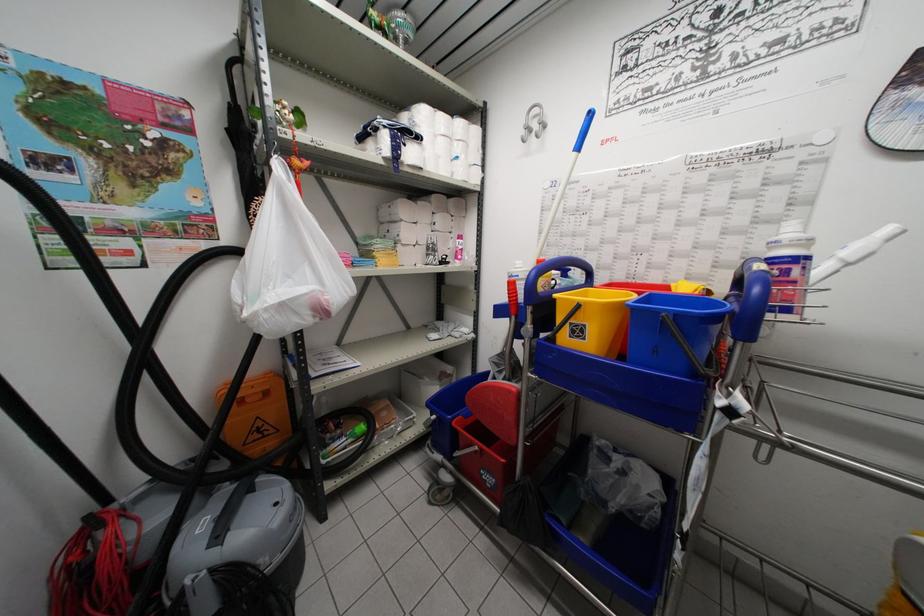
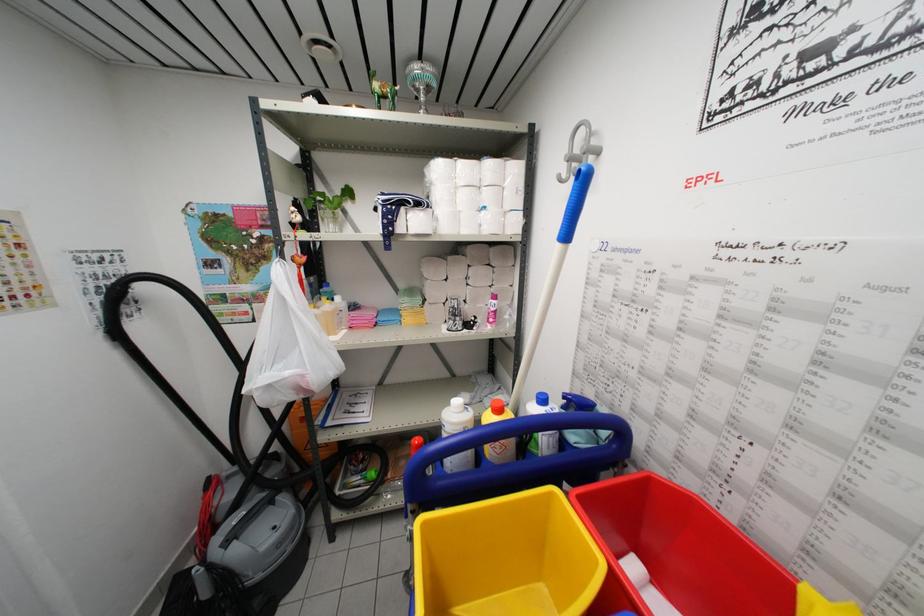
The point at (x=421, y=207) is marked in the first image. Where is the corresponding point in the second image?

(453, 262)